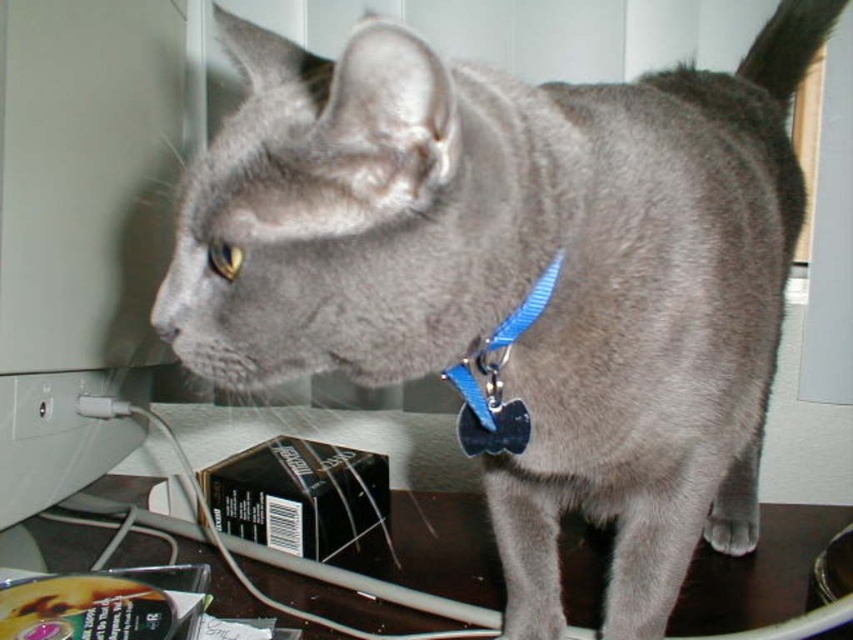
Question: Considering the real-world distances, which object is farthest from the blue plastic tag at center?

Choices:
 (A) brown wood computer desk at lower center
 (B) matte gray computer monitor at left

Answer: (B)

Question: Does matte gray computer monitor at left come behind blue plastic tag at center?

Choices:
 (A) no
 (B) yes

Answer: (B)

Question: Among these points, which one is nearest to the camera?

Choices:
 (A) (519, 316)
 (B) (103, 36)
 (C) (178, 464)

Answer: (A)

Question: Considering the relative positions of brown wood computer desk at lower center and blue plastic tag at center in the image provided, where is brown wood computer desk at lower center located with respect to blue plastic tag at center?

Choices:
 (A) left
 (B) right

Answer: (A)

Question: Which of the following is the farthest from the observer?

Choices:
 (A) (107, 557)
 (B) (67, 269)

Answer: (A)

Question: Is brown wood computer desk at lower center above blue plastic tag at center?

Choices:
 (A) yes
 (B) no

Answer: (B)